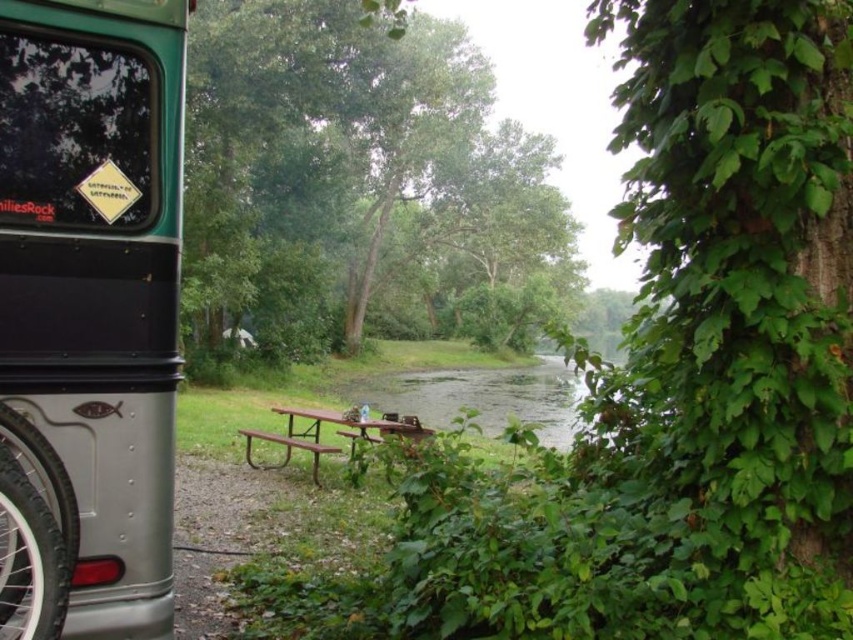
Question: Is metallic silver recreational vehicle at left smaller than brown metal picnic table at center?

Choices:
 (A) no
 (B) yes

Answer: (B)

Question: Among these objects, which one is farthest from the camera?

Choices:
 (A) green leafy tree at center
 (B) brown metal picnic table at center
 (C) metallic silver recreational vehicle at left

Answer: (B)

Question: Which point appears closest to the camera in this image?

Choices:
 (A) (138, 38)
 (B) (314, 474)
 (C) (236, 1)

Answer: (A)

Question: Based on their relative distances, which object is farther from the green leafy tree at center?

Choices:
 (A) metallic silver recreational vehicle at left
 (B) brown metal picnic table at center

Answer: (B)

Question: Does green leafy tree at center lie in front of metallic silver recreational vehicle at left?

Choices:
 (A) yes
 (B) no

Answer: (B)

Question: Does green leafy tree at center have a larger size compared to metallic silver recreational vehicle at left?

Choices:
 (A) yes
 (B) no

Answer: (A)